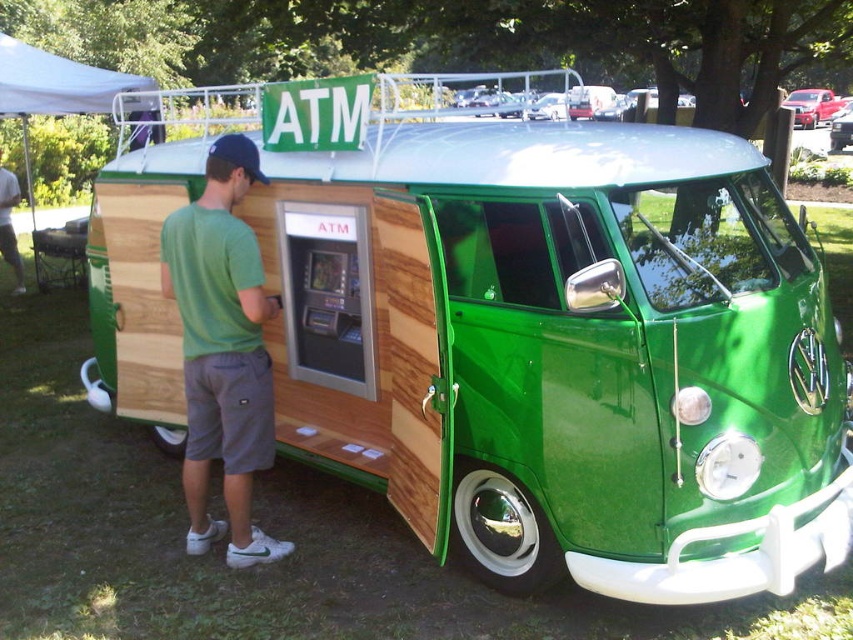
Question: Does white fabric canopy at upper left have a lesser width compared to shiny red car at upper right?

Choices:
 (A) no
 (B) yes

Answer: (B)

Question: Which object is positioned farthest from the green matte shorts at lower left?

Choices:
 (A) white fabric canopy at upper left
 (B) green matte shirt at left

Answer: (B)

Question: Is white fabric canopy at upper left to the left of metallic red car at center from the viewer's perspective?

Choices:
 (A) no
 (B) yes

Answer: (B)

Question: Which object appears closest to the camera in this image?

Choices:
 (A) green matte shorts at lower left
 (B) white fabric canopy at upper left

Answer: (B)

Question: Is white fabric canopy at upper left wider than shiny red car at upper right?

Choices:
 (A) yes
 (B) no

Answer: (B)

Question: Which object is positioned farthest from the shiny red car at upper right?

Choices:
 (A) green matte shorts at lower left
 (B) green matte shirt at left
 (C) metallic red car at center

Answer: (A)